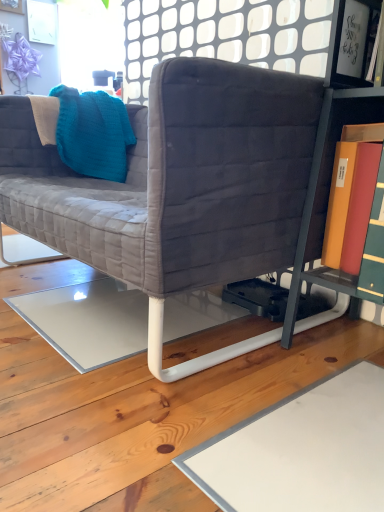
Question: From a real-world perspective, is velvet gray couch at center on top of white glossy frame at upper right?

Choices:
 (A) no
 (B) yes

Answer: (A)

Question: Is velvet gray couch at center in front of white glossy frame at upper right?

Choices:
 (A) yes
 (B) no

Answer: (A)

Question: From the image's perspective, is velvet gray couch at center above white glossy frame at upper right?

Choices:
 (A) yes
 (B) no

Answer: (B)

Question: Can you confirm if velvet gray couch at center is thinner than white glossy frame at upper right?

Choices:
 (A) no
 (B) yes

Answer: (A)

Question: Could you tell me if velvet gray couch at center is facing white glossy frame at upper right?

Choices:
 (A) no
 (B) yes

Answer: (A)

Question: From a real-world perspective, does velvet gray couch at center sit lower than white glossy frame at upper right?

Choices:
 (A) yes
 (B) no

Answer: (A)

Question: Can you confirm if teal knitted throw pillow at upper left is shorter than velvet gray couch at center?

Choices:
 (A) yes
 (B) no

Answer: (A)

Question: From the image's perspective, does teal knitted throw pillow at upper left appear lower than velvet gray couch at center?

Choices:
 (A) no
 (B) yes

Answer: (A)

Question: Considering the relative sizes of teal knitted throw pillow at upper left and velvet gray couch at center in the image provided, is teal knitted throw pillow at upper left thinner than velvet gray couch at center?

Choices:
 (A) no
 (B) yes

Answer: (B)

Question: Does teal knitted throw pillow at upper left have a greater width compared to velvet gray couch at center?

Choices:
 (A) yes
 (B) no

Answer: (B)

Question: Is teal knitted throw pillow at upper left next to velvet gray couch at center and touching it?

Choices:
 (A) no
 (B) yes

Answer: (A)

Question: Is teal knitted throw pillow at upper left closer to camera compared to velvet gray couch at center?

Choices:
 (A) yes
 (B) no

Answer: (B)

Question: Is velvet gray couch at center located outside teal knitted throw pillow at upper left?

Choices:
 (A) yes
 (B) no

Answer: (A)